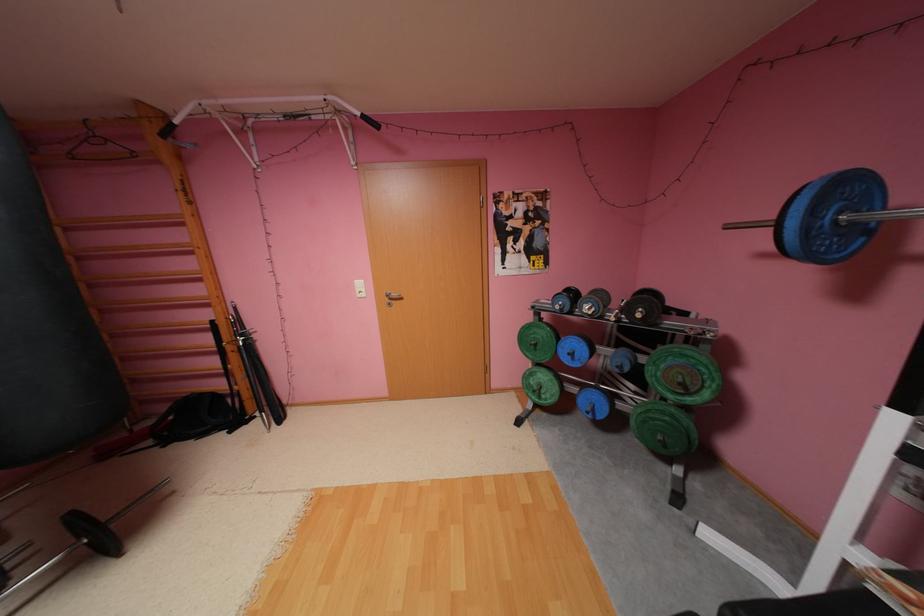
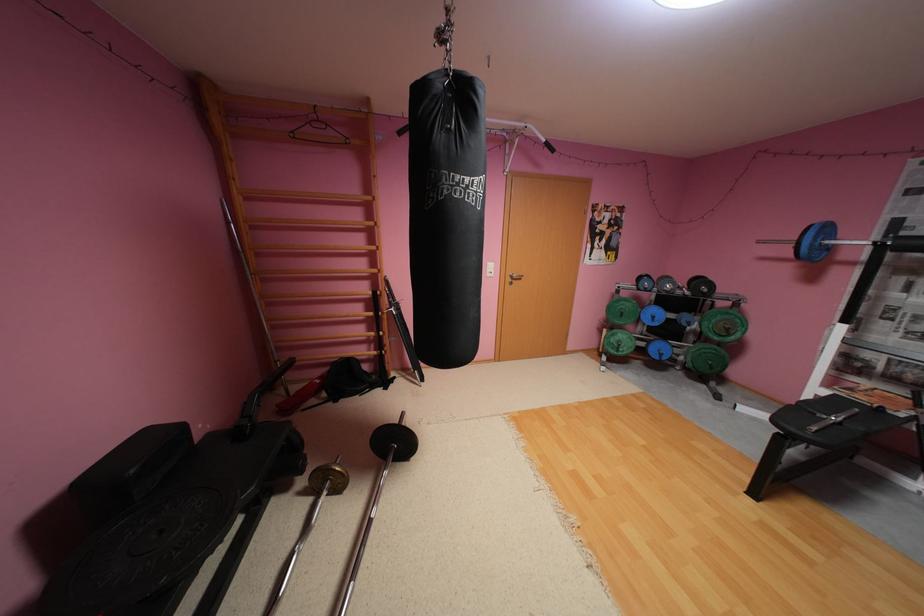
The point at (549, 398) is marked in the first image. Where is the corresponding point in the second image?

(626, 351)